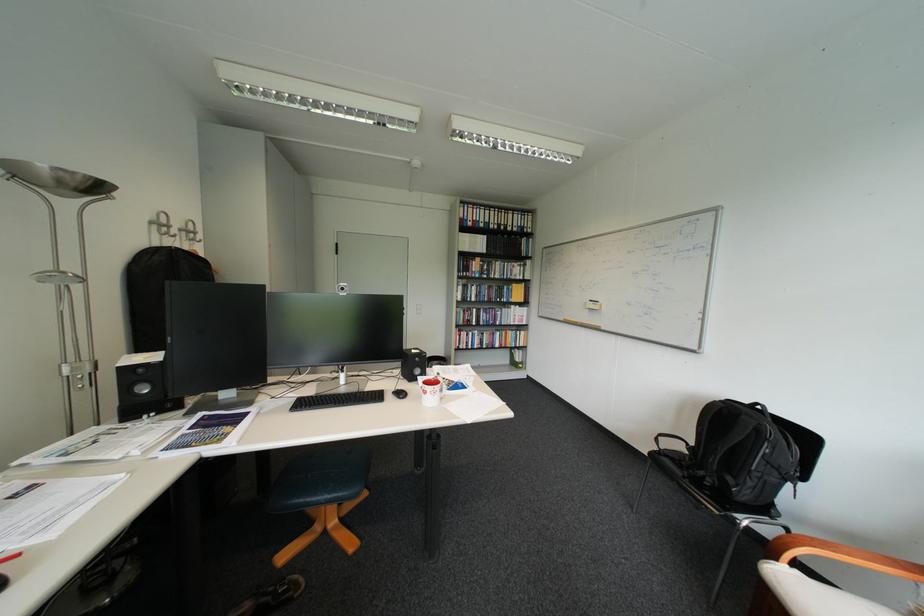
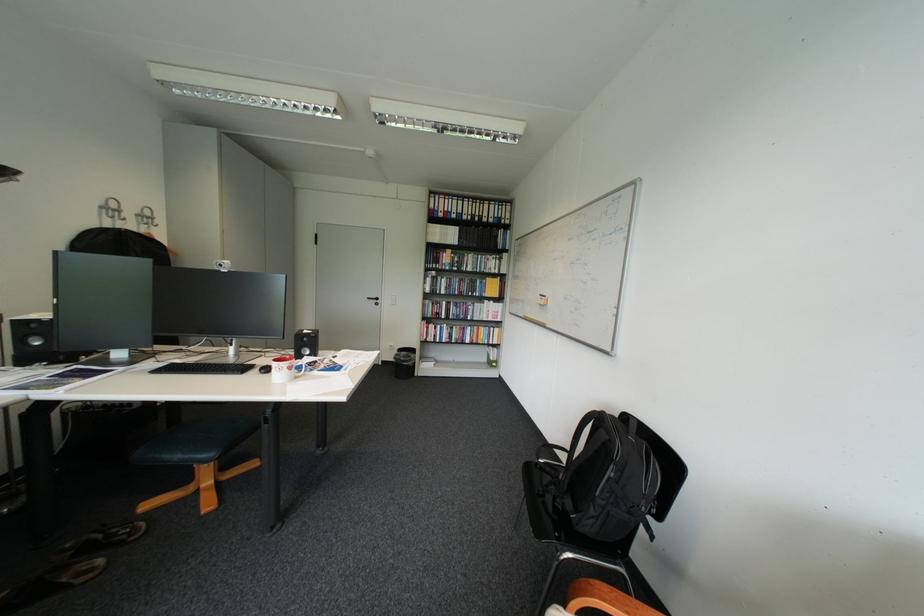
Find the pixel in the second image that matches point 417,394 in the first image.

(281, 370)